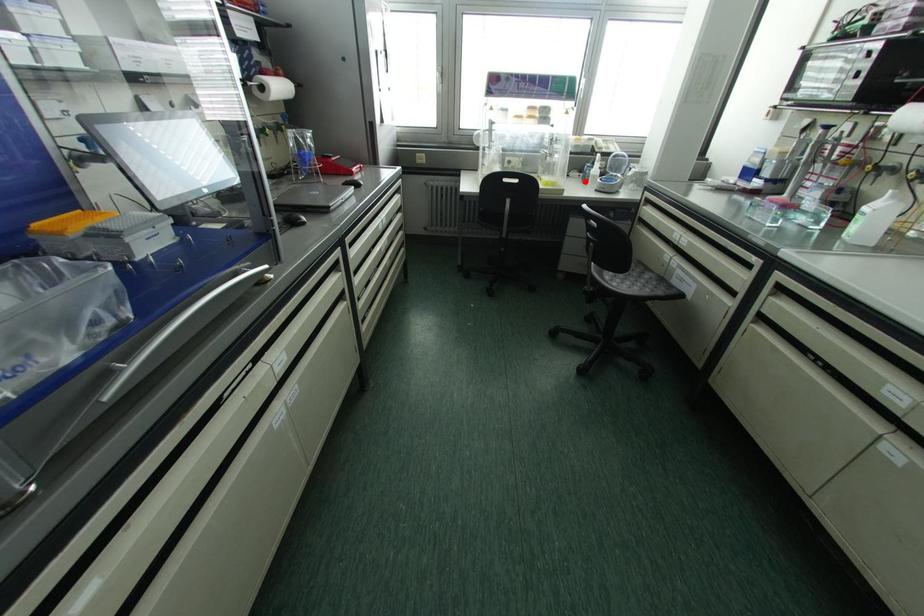
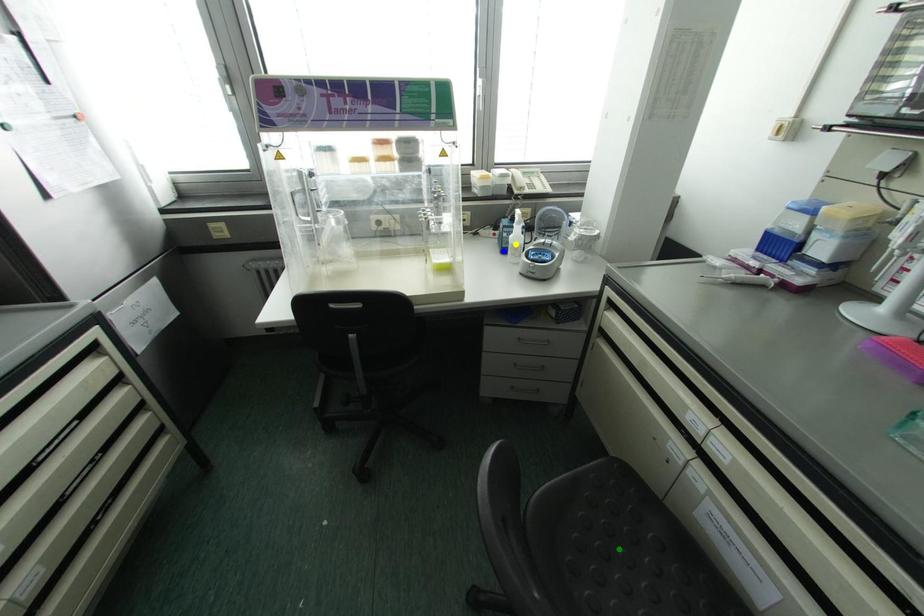
Question: I am providing you with two images of the same scene from different viewpoints. A red point is marked on the first image. You are given multiple points on the second image. Which spot in image 2 lines up with the point in image 1?

Choices:
 (A) green point
 (B) yellow point
 (C) blue point

Answer: (C)